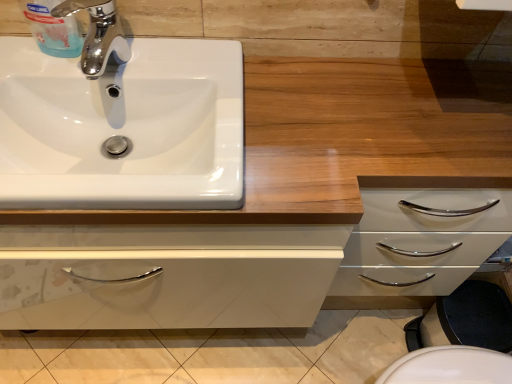
The width and height of the screenshot is (512, 384). What do you see at coordinates (98, 35) in the screenshot? I see `chrome/metallic faucet at upper left` at bounding box center [98, 35].

What is the approximate width of wooden counter at upper center?

The width of wooden counter at upper center is 46.04 centimeters.

The height and width of the screenshot is (384, 512). What do you see at coordinates (342, 139) in the screenshot? I see `wooden counter at upper center` at bounding box center [342, 139].

This screenshot has height=384, width=512. Describe the element at coordinates (123, 128) in the screenshot. I see `white glossy sink at upper left` at that location.

Find the location of a particular element. The width and height of the screenshot is (512, 384). chrome/metallic faucet at upper left is located at coordinates click(98, 35).

Is wooden counter at upper center aimed at white glossy sink at upper left?

No, wooden counter at upper center is not turned towards white glossy sink at upper left.

Is wooden counter at upper center smaller than white glossy sink at upper left?

Actually, wooden counter at upper center might be larger than white glossy sink at upper left.

From the picture: Can we say wooden counter at upper center lies outside white glossy sink at upper left?

Yes.

Which of these two, wooden counter at upper center or white glossy sink at upper left, stands shorter?

Standing shorter between the two is white glossy sink at upper left.

Is point (54, 11) closer or farther from the camera than point (215, 187)?

Point (54, 11) appears to be farther away from the viewer than point (215, 187).

Considering the sizes of objects chrome/metallic faucet at upper left and white glossy sink at upper left in the image provided, who is smaller, chrome/metallic faucet at upper left or white glossy sink at upper left?

chrome/metallic faucet at upper left.

From a real-world perspective, who is located higher, chrome/metallic faucet at upper left or white glossy sink at upper left?

In real-world perspective, chrome/metallic faucet at upper left is above.

From a real-world perspective, which is physically below, white glossy sink at upper left or chrome/metallic faucet at upper left?

From a 3D spatial view, white glossy sink at upper left is below.

Is white glossy sink at upper left facing away from chrome/metallic faucet at upper left?

No.

In the scene shown: From the image's perspective, would you say white glossy sink at upper left is shown under chrome/metallic faucet at upper left?

Indeed, from the image's perspective, white glossy sink at upper left is shown beneath chrome/metallic faucet at upper left.

From the picture: Is chrome/metallic faucet at upper left located within wooden counter at upper center?

Actually, chrome/metallic faucet at upper left is outside wooden counter at upper center.

Is wooden counter at upper center positioned far away from chrome/metallic faucet at upper left?

No, there isn't a large distance between wooden counter at upper center and chrome/metallic faucet at upper left.

Considering the positions of objects wooden counter at upper center and chrome/metallic faucet at upper left in the image provided, who is more to the right, wooden counter at upper center or chrome/metallic faucet at upper left?

wooden counter at upper center.

Is wooden counter at upper center further to the viewer compared to chrome/metallic faucet at upper left?

No, wooden counter at upper center is closer to the camera.

Is white glossy sink at upper left wider than wooden counter at upper center?

No.

Which is behind, point (3, 98) or point (296, 161)?

The point (3, 98) is farther from the camera.

Which of these two, white glossy sink at upper left or wooden counter at upper center, stands taller?

wooden counter at upper center.

Consider the image. Is wooden counter at upper center completely or partially inside white glossy sink at upper left?

Actually, wooden counter at upper center is outside white glossy sink at upper left.

Who is shorter, chrome/metallic faucet at upper left or wooden counter at upper center?

Standing shorter between the two is chrome/metallic faucet at upper left.

This screenshot has height=384, width=512. Find the location of `counter top located underneath the chrome/metallic faucet at upper left (from a real-world perspective)`. counter top located underneath the chrome/metallic faucet at upper left (from a real-world perspective) is located at coordinates click(342, 139).

Could you tell me if chrome/metallic faucet at upper left is facing wooden counter at upper center?

No, chrome/metallic faucet at upper left does not turn towards wooden counter at upper center.

From a real-world perspective, does chrome/metallic faucet at upper left stand above wooden counter at upper center?

Yes, from a real-world perspective, chrome/metallic faucet at upper left is on top of wooden counter at upper center.

Image resolution: width=512 pixels, height=384 pixels. I want to click on counter top that appears on the right of white glossy sink at upper left, so click(x=342, y=139).

Image resolution: width=512 pixels, height=384 pixels. I want to click on tap above the white glossy sink at upper left (from a real-world perspective), so 98,35.

Looking at the image, which one is located closer to chrome/metallic faucet at upper left, wooden counter at upper center or white glossy sink at upper left?

white glossy sink at upper left lies closer to chrome/metallic faucet at upper left than the other object.

Looking at the image, which one is located closer to white glossy sink at upper left, chrome/metallic faucet at upper left or wooden counter at upper center?

chrome/metallic faucet at upper left is closer to white glossy sink at upper left.

When comparing their distances from wooden counter at upper center, does white glossy sink at upper left or chrome/metallic faucet at upper left seem further?

Among the two, chrome/metallic faucet at upper left is located further to wooden counter at upper center.

When comparing their distances from white glossy sink at upper left, does wooden counter at upper center or chrome/metallic faucet at upper left seem further?

wooden counter at upper center.

Estimate the real-world distances between objects in this image. Which object is closer to wooden counter at upper center, chrome/metallic faucet at upper left or white glossy sink at upper left?

white glossy sink at upper left is closer to wooden counter at upper center.

Based on the photo, considering their positions, is white glossy sink at upper left positioned closer to chrome/metallic faucet at upper left than wooden counter at upper center?

Based on the image, white glossy sink at upper left appears to be nearer to chrome/metallic faucet at upper left.

Locate an element on the screen. The height and width of the screenshot is (384, 512). sink between chrome/metallic faucet at upper left and wooden counter at upper center in the up-down direction is located at coordinates 123,128.